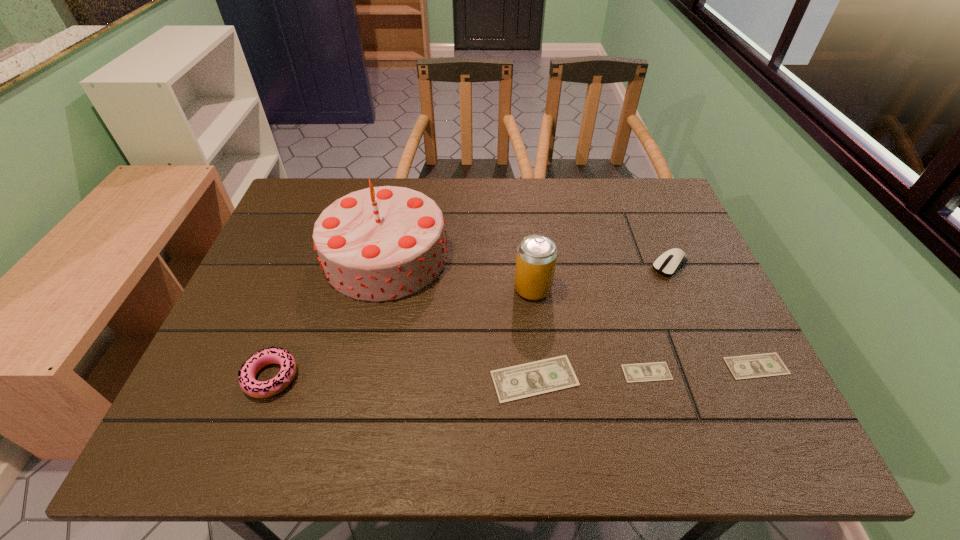
Find the location of `vacant space in between the tallest object and the shortest money`. vacant space in between the tallest object and the shortest money is located at coordinates (516, 314).

The image size is (960, 540). I want to click on free space between the doughnut and the birthday cake, so click(328, 316).

The height and width of the screenshot is (540, 960). Identify the location of vacant space that's between the mouse and the pop (soda). (601, 277).

The width and height of the screenshot is (960, 540). I want to click on free space between the tallest object and the sixth tallest object, so click(x=571, y=310).

This screenshot has width=960, height=540. Find the location of `free space between the shortest money and the doughnut`. free space between the shortest money and the doughnut is located at coordinates (459, 375).

Identify the location of vacant space in between the shortest object and the sixth tallest object. Image resolution: width=960 pixels, height=540 pixels. (702, 369).

You are a GUI agent. You are given a task and a screenshot of the screen. Output one action in this format:
    pyautogui.click(x=<x>, y=<y>)
    Task: Click on the vacant area that lies between the doughnut and the pop (soda)
    Image resolution: width=960 pixels, height=540 pixels.
    Given the screenshot: What is the action you would take?
    pyautogui.click(x=402, y=333)

The image size is (960, 540). I want to click on empty location between the mouse and the rightmost money, so click(713, 315).

This screenshot has width=960, height=540. Find the location of `free space between the tallest money and the tallest object`. free space between the tallest money and the tallest object is located at coordinates (460, 317).

Find the location of a particular element. The width and height of the screenshot is (960, 540). free space between the rightmost money and the sixth shortest object is located at coordinates (644, 327).